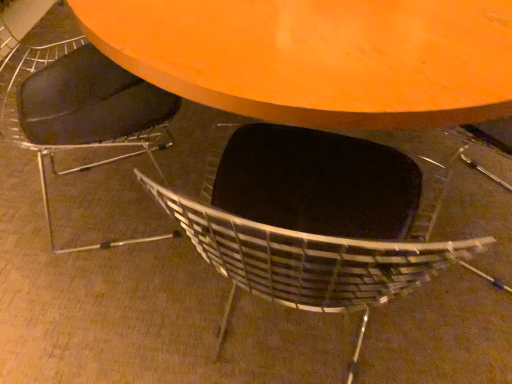
Question: Considering the positions of matte black chair at lower center, placed as the 1th chair when sorted from left to right, and black leather chair at center, the first chair in the right-to-left sequence, in the image, is matte black chair at lower center, placed as the 1th chair when sorted from left to right, bigger or smaller than black leather chair at center, the first chair in the right-to-left sequence,?

Choices:
 (A) big
 (B) small

Answer: (B)

Question: Considering the positions of matte black chair at lower center, placed as the 1th chair when sorted from left to right, and black leather chair at center, which is counted as the second chair, starting from the left, in the image, is matte black chair at lower center, placed as the 1th chair when sorted from left to right, taller or shorter than black leather chair at center, which is counted as the second chair, starting from the left,?

Choices:
 (A) tall
 (B) short

Answer: (A)

Question: Do you think matte black chair at lower center, placed as the 1th chair when sorted from left to right, is within black leather chair at center, the first chair in the right-to-left sequence, or outside of it?

Choices:
 (A) inside
 (B) outside

Answer: (B)

Question: Which is correct: black leather chair at center, which is counted as the second chair, starting from the left, is inside matte black chair at lower center, placed as the 1th chair when sorted from left to right, or outside of it?

Choices:
 (A) inside
 (B) outside

Answer: (B)

Question: From a real-world perspective, is black leather chair at center, which is counted as the second chair, starting from the left, above or below matte black chair at lower center, the 2th chair in the right-to-left sequence?

Choices:
 (A) below
 (B) above

Answer: (A)

Question: From the image's perspective, is black leather chair at center, which is counted as the second chair, starting from the left, located above or below matte black chair at lower center, the 2th chair in the right-to-left sequence?

Choices:
 (A) below
 (B) above

Answer: (A)

Question: Considering the relative positions of black leather chair at center, which is counted as the second chair, starting from the left, and matte black chair at lower center, placed as the 1th chair when sorted from left to right, in the image provided, is black leather chair at center, which is counted as the second chair, starting from the left, to the left or to the right of matte black chair at lower center, placed as the 1th chair when sorted from left to right,?

Choices:
 (A) left
 (B) right

Answer: (B)